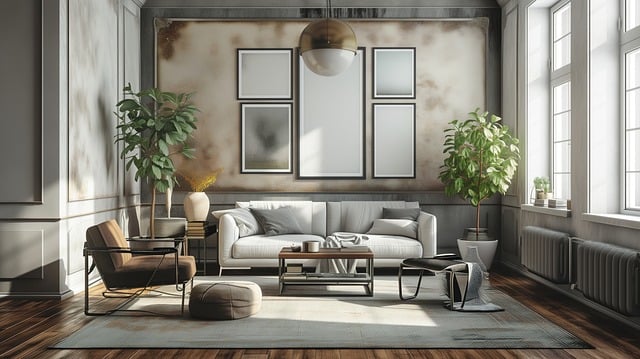
I want to click on plant pots, so click(484, 248), click(192, 205), click(176, 224), click(163, 241).